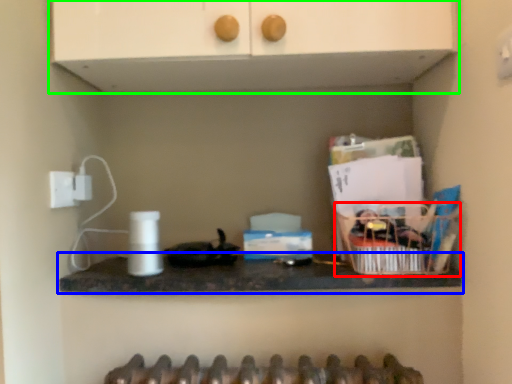
Question: Which is farther away from basket (highlighted by a red box)? countertop (highlighted by a blue box) or cabinetry (highlighted by a green box)?

Choices:
 (A) countertop
 (B) cabinetry

Answer: (B)